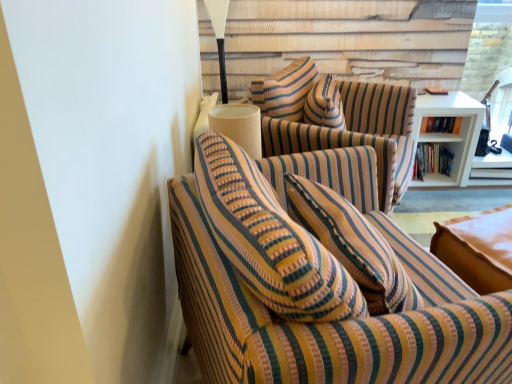
Locate an element on the screen. The width and height of the screenshot is (512, 384). transparent glass door at upper right is located at coordinates (490, 60).

Measure the distance between point (447, 123) and camera.

Point (447, 123) is 2.51 meters from camera.

What do you see at coordinates (338, 120) in the screenshot?
I see `striped fabric swivel chair at center` at bounding box center [338, 120].

Describe the element at coordinates (219, 37) in the screenshot. I see `white matte table lamp at upper center` at that location.

At what (x,y) coordinates should I click in order to perform the action: click on white wood bookshelf at right. Please return your answer as a coordinate pair (x, y). This screenshot has width=512, height=384. Looking at the image, I should click on (450, 134).

In the scene shown: Considering the positions of objects white matte table lamp at upper center and transparent glass door at upper right in the image provided, who is more to the left, white matte table lamp at upper center or transparent glass door at upper right?

white matte table lamp at upper center is more to the left.

Can transparent glass door at upper right be found inside white matte table lamp at upper center?

No, transparent glass door at upper right is not surrounded by white matte table lamp at upper center.

How far apart are white matte table lamp at upper center and transparent glass door at upper right?

A distance of 5.13 feet exists between white matte table lamp at upper center and transparent glass door at upper right.

Could you tell me if white matte table lamp at upper center is facing transparent glass door at upper right?

No, white matte table lamp at upper center is not oriented towards transparent glass door at upper right.

You are a GUI agent. You are given a task and a screenshot of the screen. Output one action in this format:
    pyautogui.click(x=<x>, y=<y>)
    Task: Click on the studio couch that is in front of the hardcover book at upper right, the 1th book positioned from the top
    This screenshot has height=384, width=512.
    Given the screenshot: What is the action you would take?
    pyautogui.click(x=317, y=286)

Is striped fabric couch at left positioned before hardcover book at upper right, the 1th book positioned from the top?

Yes.

What's the angular difference between striped fabric couch at left and hardcover book at upper right, which is the 2th book from bottom to top,'s facing directions?

110 degrees separate the facing orientations of striped fabric couch at left and hardcover book at upper right, which is the 2th book from bottom to top.

Is striped fabric couch at left aimed at hardcover book at upper right, which is the 2th book from bottom to top?

No, striped fabric couch at left does not turn towards hardcover book at upper right, which is the 2th book from bottom to top.

Locate an element on the screen. The image size is (512, 384). table lying below the transparent glass door at upper right (from the image's perspective) is located at coordinates (450, 134).

Is transparent glass door at upper right inside the boundaries of white wood bookshelf at right, or outside?

transparent glass door at upper right exists outside the volume of white wood bookshelf at right.

Is transparent glass door at upper right wider than white wood bookshelf at right?

In fact, transparent glass door at upper right might be narrower than white wood bookshelf at right.

Considering the sizes of objects striped fabric couch at left and white matte table lamp at upper center in the image provided, who is wider, striped fabric couch at left or white matte table lamp at upper center?

With larger width is striped fabric couch at left.

How different are the orientations of striped fabric couch at left and white matte table lamp at upper center in degrees?

The angular difference between striped fabric couch at left and white matte table lamp at upper center is 110 degrees.

Considering the sizes of objects striped fabric couch at left and white matte table lamp at upper center in the image provided, who is smaller, striped fabric couch at left or white matte table lamp at upper center?

white matte table lamp at upper center.

Is striped fabric couch at left facing away from white matte table lamp at upper center?

No, striped fabric couch at left is not facing away from white matte table lamp at upper center.

How many degrees apart are the facing directions of hardcover books at right, acting as the second book starting from the top, and transparent glass door at upper right?

hardcover books at right, acting as the second book starting from the top, and transparent glass door at upper right are facing 0.421 degrees away from each other.

From the image's perspective, is hardcover books at right, acting as the second book starting from the top, over transparent glass door at upper right?

No, from the image's perspective, hardcover books at right, acting as the second book starting from the top, is not above transparent glass door at upper right.

From a real-world perspective, is hardcover books at right, acting as the second book starting from the top, positioned under transparent glass door at upper right based on gravity?

Indeed, from a real-world perspective, hardcover books at right, acting as the second book starting from the top, is positioned beneath transparent glass door at upper right.

Is hardcover books at right, the 1th book when ordered from bottom to top, facing away from transparent glass door at upper right?

That's not correct — hardcover books at right, the 1th book when ordered from bottom to top, is not looking away from transparent glass door at upper right.

Consider the image. Which is behind, striped fabric swivel chair at center or hardcover books at right, acting as the second book starting from the top?

hardcover books at right, acting as the second book starting from the top, is more distant.

Is striped fabric swivel chair at center to the left or to the right of hardcover books at right, the 1th book when ordered from bottom to top, in the image?

In the image, striped fabric swivel chair at center appears on the left side of hardcover books at right, the 1th book when ordered from bottom to top.

Is hardcover books at right, acting as the second book starting from the top, at the back of striped fabric swivel chair at center?

No.

Is striped fabric swivel chair at center positioned beyond the bounds of hardcover books at right, acting as the second book starting from the top?

Yes, striped fabric swivel chair at center is not within hardcover books at right, acting as the second book starting from the top.

Between white matte table lamp at upper center and striped fabric swivel chair at center, which one is positioned in front?

striped fabric swivel chair at center is more forward.

From a real-world perspective, is white matte table lamp at upper center positioned over striped fabric swivel chair at center based on gravity?

Indeed, from a real-world perspective, white matte table lamp at upper center stands above striped fabric swivel chair at center.

Is white matte table lamp at upper center with striped fabric swivel chair at center?

No, white matte table lamp at upper center is not in contact with striped fabric swivel chair at center.

At what (x,y) coordinates should I click in order to perform the action: click on table lamp in front of the transparent glass door at upper right. Please return your answer as a coordinate pair (x, y). This screenshot has width=512, height=384. Looking at the image, I should click on (219, 37).

Where is `studio couch above the hardcover book at upper right, which is the 2th book from bottom to top (from a real-world perspective)`? This screenshot has height=384, width=512. studio couch above the hardcover book at upper right, which is the 2th book from bottom to top (from a real-world perspective) is located at coordinates (317, 286).

Looking at the image, which one is located closer to transparent glass door at upper right, hardcover books at right, the 1th book when ordered from bottom to top, or hardcover book at upper right, which is the 2th book from bottom to top?

hardcover books at right, the 1th book when ordered from bottom to top, is closer to transparent glass door at upper right.

Looking at the image, which one is located further to hardcover books at right, the 1th book when ordered from bottom to top, hardcover book at upper right, which is the 2th book from bottom to top, or white wood bookshelf at right?

hardcover book at upper right, which is the 2th book from bottom to top, is further to hardcover books at right, the 1th book when ordered from bottom to top.

Looking at the image, which one is located further to white matte table lamp at upper center, transparent glass door at upper right or white wood bookshelf at right?

Among the two, transparent glass door at upper right is located further to white matte table lamp at upper center.

Which object lies nearer to the anchor point hardcover books at right, the 1th book when ordered from bottom to top, white matte table lamp at upper center or transparent glass door at upper right?

Based on the image, transparent glass door at upper right appears to be nearer to hardcover books at right, the 1th book when ordered from bottom to top.

When comparing their distances from hardcover book at upper right, the 1th book positioned from the top, does hardcover books at right, acting as the second book starting from the top, or white wood bookshelf at right seem closer?

white wood bookshelf at right lies closer to hardcover book at upper right, the 1th book positioned from the top, than the other object.

Looking at the image, which one is located closer to hardcover book at upper right, the 1th book positioned from the top, white wood bookshelf at right or striped fabric couch at left?

white wood bookshelf at right is closer to hardcover book at upper right, the 1th book positioned from the top.

Considering their positions, is striped fabric couch at left positioned closer to white wood bookshelf at right than striped fabric swivel chair at center?

Based on the image, striped fabric swivel chair at center appears to be nearer to white wood bookshelf at right.

Estimate the real-world distances between objects in this image. Which object is closer to hardcover books at right, the 1th book when ordered from bottom to top, white wood bookshelf at right or striped fabric couch at left?

Based on the image, white wood bookshelf at right appears to be nearer to hardcover books at right, the 1th book when ordered from bottom to top.

Where is `swivel chair between white matte table lamp at upper center and transparent glass door at upper right`? The width and height of the screenshot is (512, 384). swivel chair between white matte table lamp at upper center and transparent glass door at upper right is located at coordinates (338, 120).

Locate an element on the screen. This screenshot has width=512, height=384. table lamp between striped fabric couch at left and hardcover books at right, acting as the second book starting from the top, in the front-back direction is located at coordinates (219, 37).

The width and height of the screenshot is (512, 384). I want to click on table lamp between striped fabric couch at left and transparent glass door at upper right from front to back, so click(219, 37).

At what (x,y) coordinates should I click in order to perform the action: click on book located between striped fabric couch at left and hardcover book at upper right, which is the 2th book from bottom to top, in the depth direction. Please return your answer as a coordinate pair (x, y). Image resolution: width=512 pixels, height=384 pixels. Looking at the image, I should click on (431, 161).